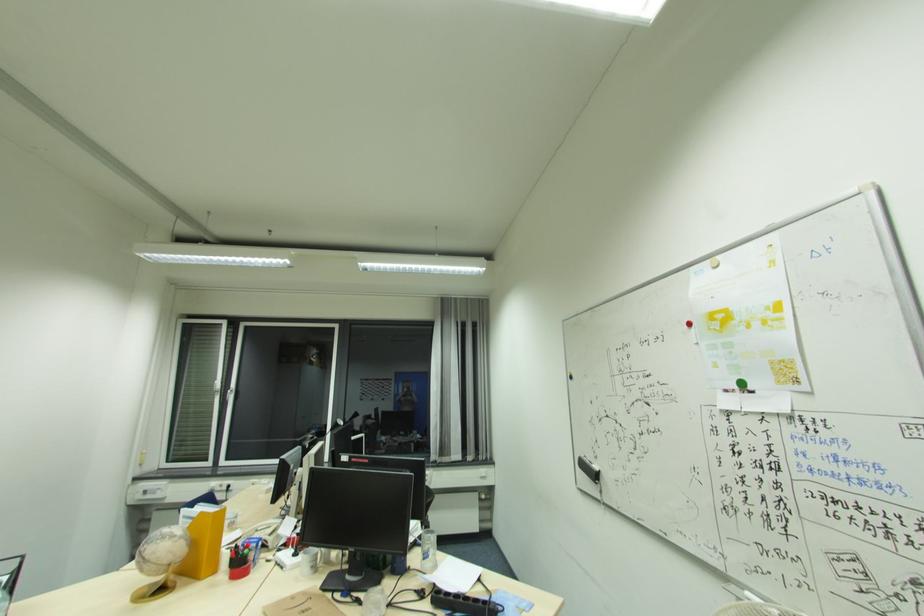
The width and height of the screenshot is (924, 616). What do you see at coordinates (229, 391) in the screenshot? I see `a white window handle` at bounding box center [229, 391].